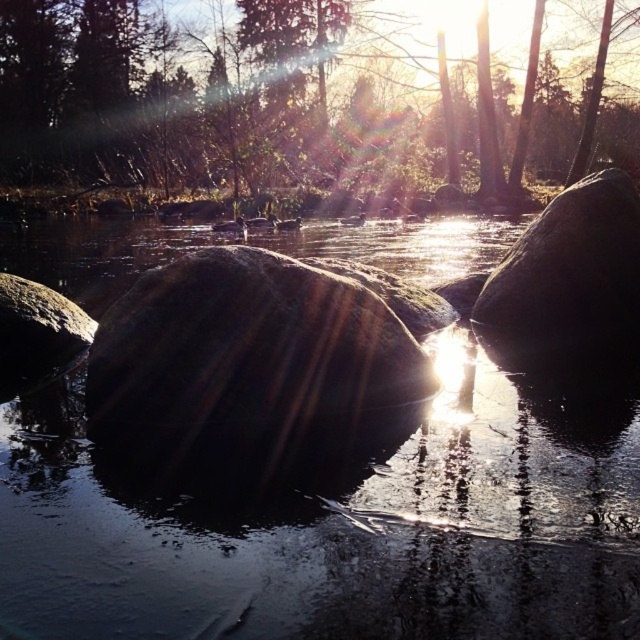
You are a photographer trying to capture the reflection of the sun in the water. You have two rocks to use as props. The smooth rock at center and the shiny dark rock at right. Which rock should you place closer to the water to ensure the reflection is visible?

The smooth rock at center is shorter than the shiny dark rock at right, so placing the smooth rock at center closer to the water would ensure the reflection is visible because its lower height won

You are a photographer trying to capture the reflection of the green matte tree at upper center and the shiny dark rock at right in the water. Which object will have its reflection closer to the photographer?

The shiny dark rock at right will have its reflection closer to the photographer because reflections are mirrored below the actual objects. Since the green matte tree at upper center is above the shiny dark rock at right, its reflection would be further away from the photographer compared to the reflection of the shiny dark rock at right.